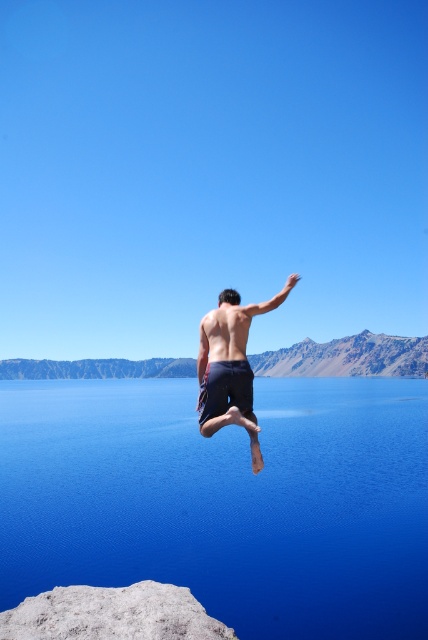
How much distance is there between gray rough rock at lower left and muscular tan skin at center?

They are 16.11 meters apart.

Which of these two, gray rough rock at lower left or muscular tan skin at center, stands shorter?

Standing shorter between the two is gray rough rock at lower left.

What do you see at coordinates (112, 614) in the screenshot?
I see `gray rough rock at lower left` at bounding box center [112, 614].

Identify the location of gray rough rock at lower left. (112, 614).

Which is below, gray rough rock at lower left or dark blue shorts at center?

Positioned lower is gray rough rock at lower left.

Does point (64, 600) come in front of point (211, 314)?

Yes, point (64, 600) is in front of point (211, 314).

In order to click on gray rough rock at lower left in this screenshot , I will do `click(112, 614)`.

This screenshot has width=428, height=640. I want to click on gray rough rock at lower left, so click(112, 614).

Who is more forward, (x=33, y=506) or (x=208, y=340)?

Positioned in front is point (x=208, y=340).

Is blue smooth water at center wider than muscular tan skin at center?

Correct, the width of blue smooth water at center exceeds that of muscular tan skin at center.

Is point (109, 532) less distant than point (234, 307)?

No, it is behind (234, 307).

This screenshot has width=428, height=640. Identify the location of blue smooth water at center. (225, 500).